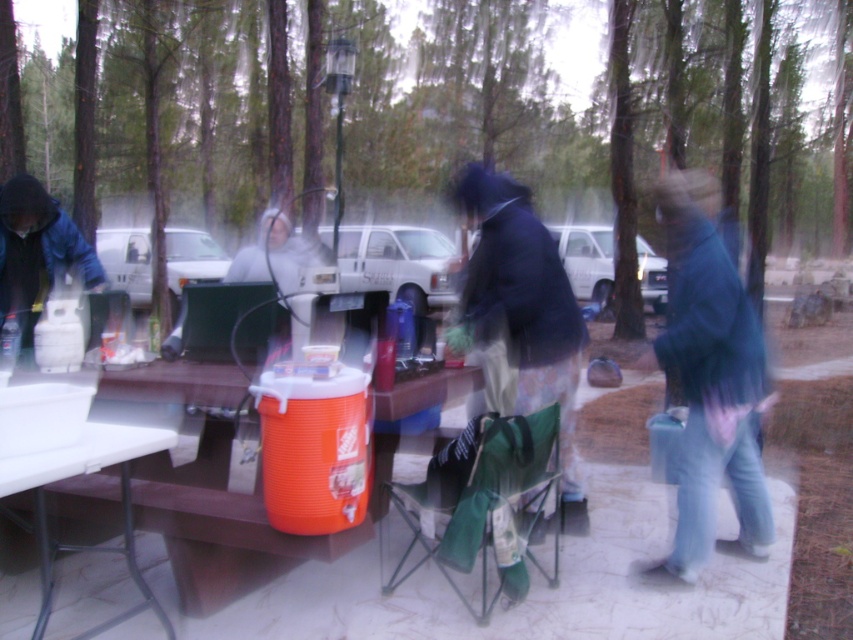
Between point (538, 262) and point (68, 449), which one is positioned in front?

Point (68, 449) is in front.

Does dark blue jacket at center appear over white plastic table at lower left?

Indeed, dark blue jacket at center is positioned over white plastic table at lower left.

The height and width of the screenshot is (640, 853). Find the location of `dark blue jacket at center`. dark blue jacket at center is located at coordinates (524, 307).

Is blue fuzzy jacket at right further to the viewer compared to dark blue jacket at center?

That is True.

Which is behind, point (759, 476) or point (560, 298)?

Point (759, 476)

The height and width of the screenshot is (640, 853). What do you see at coordinates (709, 378) in the screenshot?
I see `blue fuzzy jacket at right` at bounding box center [709, 378].

I want to click on blue fuzzy jacket at right, so click(x=709, y=378).

Based on the photo, is blue fuzzy jacket at right wider than white plastic table at lower left?

No.

Does blue fuzzy jacket at right appear on the right side of white plastic table at lower left?

Yes, blue fuzzy jacket at right is to the right of white plastic table at lower left.

Where is `blue fuzzy jacket at right`? blue fuzzy jacket at right is located at coordinates (709, 378).